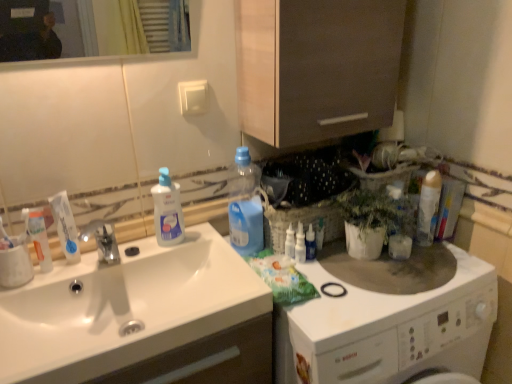
I want to click on free location to the left of clear plastic bottle at sink, which ranks as the third cleaning product in right-to-left order, so pos(123,256).